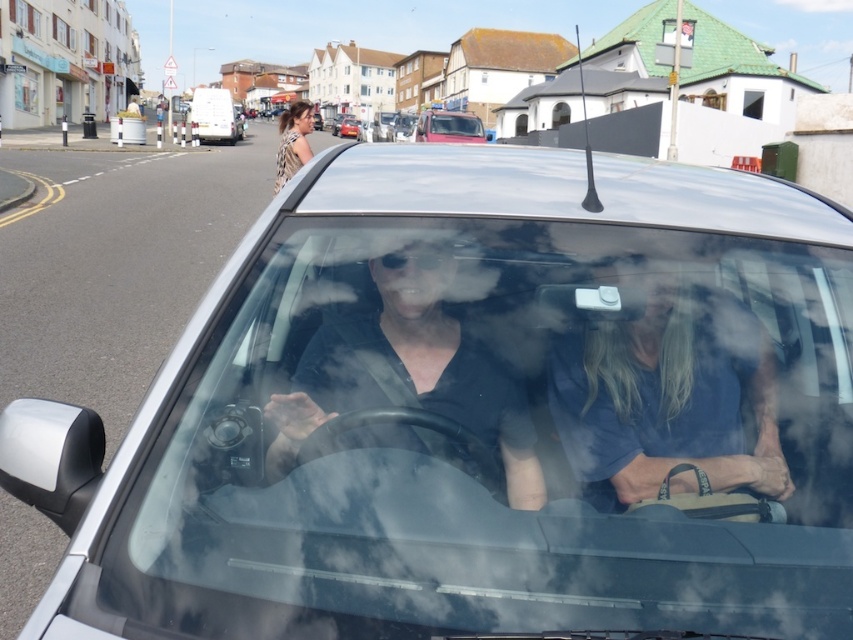
You are standing on the street and want to determine which of the two points, point (578, 328) or point (303, 122), is nearer to you. Based on the scene, which point is closer?

Point (578, 328) is closer to the viewer than point (303, 122).

You are a delivery person who needs to hand over a package to the passenger in the car. You are standing outside the car and see the blue fabric bag at center and the matte black shirt at center. Which object is closer to you?

The blue fabric bag at center is closer to you because it is further to the viewer than the matte black shirt at center.